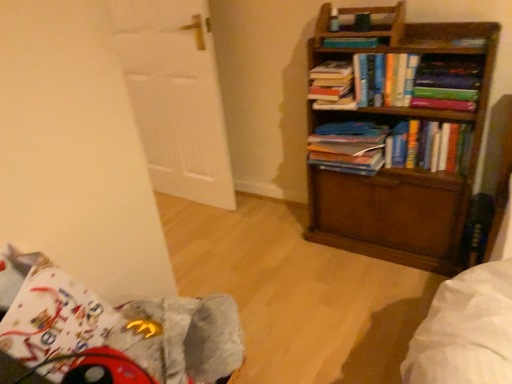
Identify the location of free spot above hardcover book at upper center, marked as the 4th book in a bottom-to-top arrangement (from a real-world perspective). (330, 65).